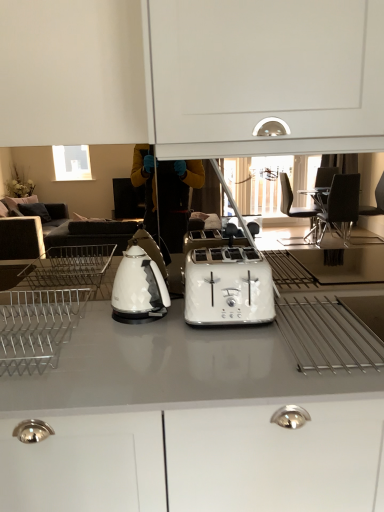
Locate an element on the screen. Image resolution: width=384 pixels, height=512 pixels. vacant space underneath white glossy electric kettle at left (from a real-world perspective) is located at coordinates click(x=138, y=321).